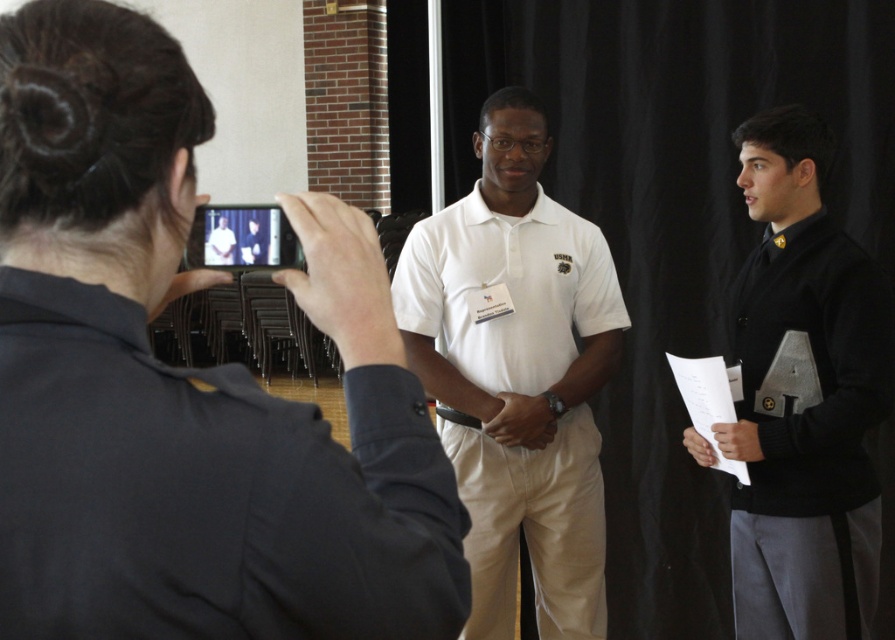
Question: Can you confirm if white matte shirt at center is thinner than black matte sweater at center?

Choices:
 (A) no
 (B) yes

Answer: (A)

Question: Is the position of black fabric at upper left more distant than that of black matte sweater at center?

Choices:
 (A) yes
 (B) no

Answer: (B)

Question: Which point is closer to the camera?

Choices:
 (A) (490, 579)
 (B) (286, 417)
 (C) (797, 324)

Answer: (B)

Question: Estimate the real-world distances between objects in this image. Which object is farther from the black matte sweater at center?

Choices:
 (A) white matte shirt at center
 (B) black fabric at upper left

Answer: (B)

Question: Can you confirm if white matte shirt at center is smaller than black matte sweater at center?

Choices:
 (A) no
 (B) yes

Answer: (A)

Question: Which point is farther to the camera?

Choices:
 (A) (493, 496)
 (B) (137, 160)

Answer: (A)